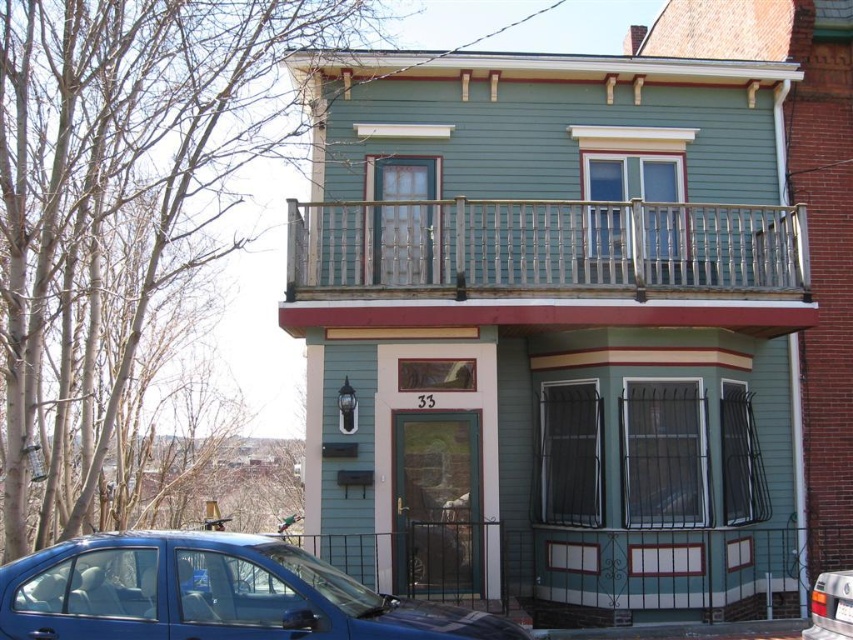
You are a delivery person trying to determine if a large package can fit through the space between the wooden at upper center and the metallic blue sedan at lower left. Can you confirm if there is enough space?

The wooden at upper center is wider than the metallic blue sedan at lower left, so the space between them may be sufficient for the package, but the exact width isn